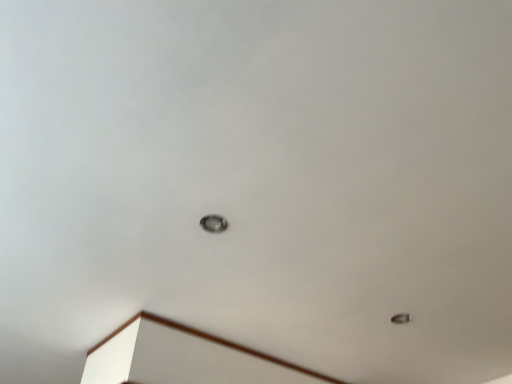
Question: Is satin silver lamp at center, which appears as the second lamp when viewed from the right, taller or shorter than metallic ring at lower right, positioned as the first lamp in right-to-left order?

Choices:
 (A) tall
 (B) short

Answer: (A)

Question: In terms of size, does satin silver lamp at center, placed as the 1th lamp when sorted from front to back, appear bigger or smaller than metallic ring at lower right, positioned as the second lamp in left-to-right order?

Choices:
 (A) big
 (B) small

Answer: (A)

Question: Is satin silver lamp at center, placed as the second lamp when sorted from bottom to top, inside the boundaries of metallic ring at lower right, the first lamp from the bottom, or outside?

Choices:
 (A) outside
 (B) inside

Answer: (A)

Question: Does point (404, 317) appear closer or farther from the camera than point (205, 230)?

Choices:
 (A) farther
 (B) closer

Answer: (A)

Question: Based on their sizes in the image, would you say metallic ring at lower right, positioned as the first lamp in right-to-left order, is bigger or smaller than satin silver lamp at center, which is the 1th lamp in top-to-bottom order?

Choices:
 (A) small
 (B) big

Answer: (A)

Question: From a real-world perspective, is metallic ring at lower right, the second lamp from the front, positioned above or below satin silver lamp at center, which is the second lamp in back-to-front order?

Choices:
 (A) above
 (B) below

Answer: (B)

Question: From the image's perspective, relative to satin silver lamp at center, positioned as the 1th lamp in left-to-right order, is metallic ring at lower right, positioned as the first lamp in right-to-left order, above or below?

Choices:
 (A) above
 (B) below

Answer: (B)